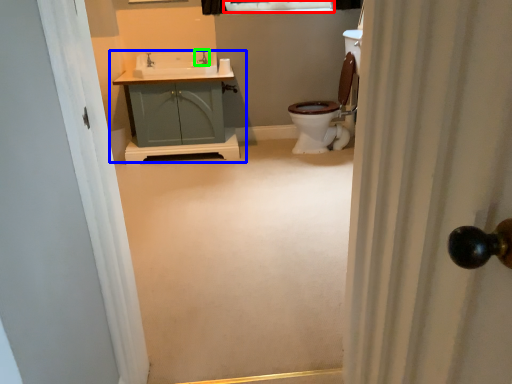
Question: Considering the real-world distances, which object is closest to window (highlighted by a red box)? bathroom cabinet (highlighted by a blue box) or tap (highlighted by a green box).

Choices:
 (A) bathroom cabinet
 (B) tap

Answer: (B)